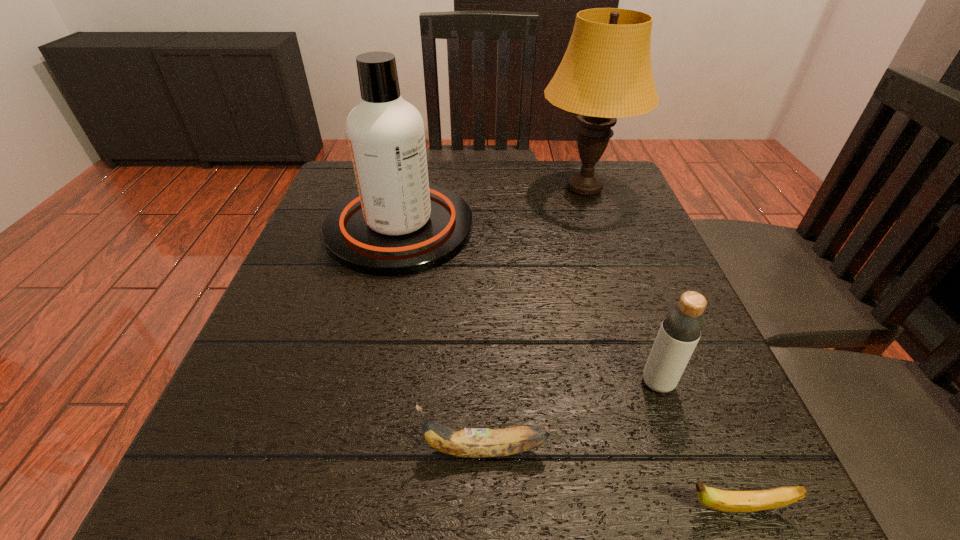
Where is `empty location between the third farthest object and the lampshade`? This screenshot has height=540, width=960. empty location between the third farthest object and the lampshade is located at coordinates (621, 285).

Find the location of a particular element. Image resolution: width=960 pixels, height=540 pixels. object that stands as the closest to the shortest object is located at coordinates (683, 324).

Identify the location of the closest object to the bottle. (720, 500).

This screenshot has width=960, height=540. I want to click on vacant space that satisfies the following two spatial constraints: 1. on the front side of the bottle; 2. on the right side of the cleansing agent, so click(364, 382).